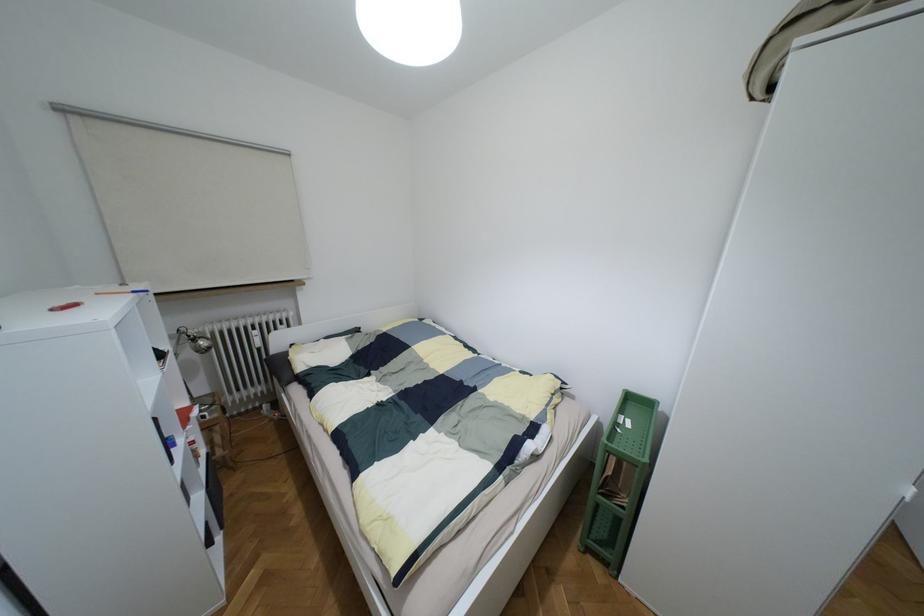
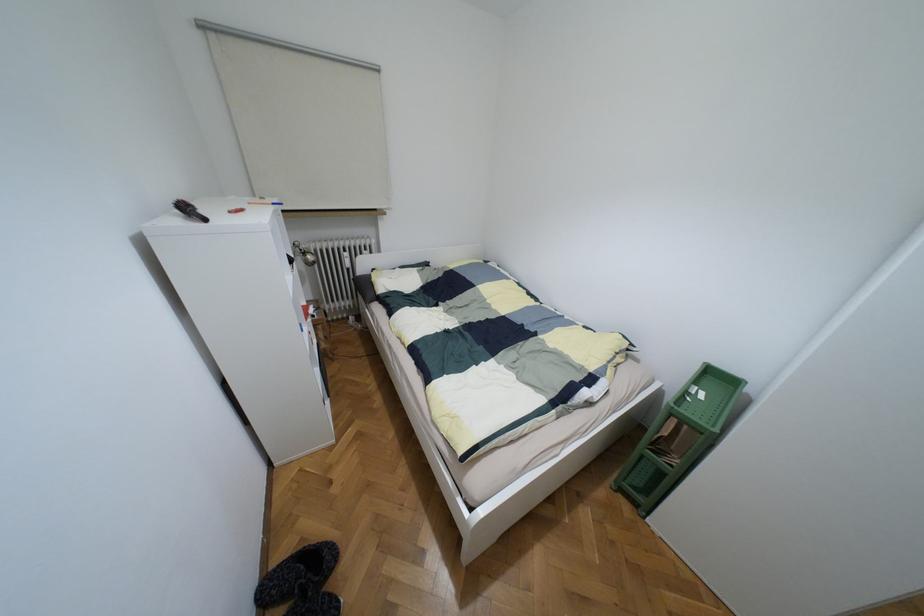
What movement of the cameraman would produce the second image?

The movement direction of the cameraman is left, backward.